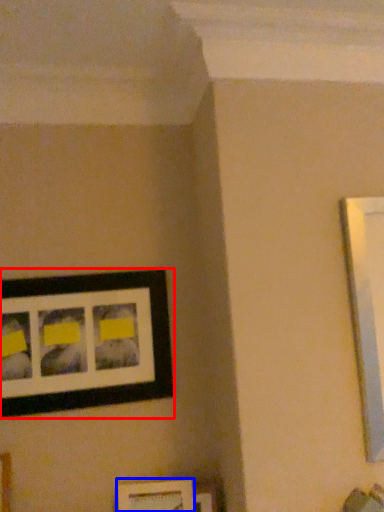
Question: Which object is closer to the camera taking this photo, picture frame (highlighted by a red box) or picture frame (highlighted by a blue box)?

Choices:
 (A) picture frame
 (B) picture frame

Answer: (B)